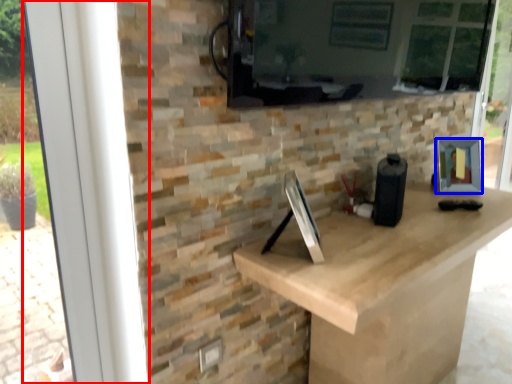
Question: Which point is closer to the camera, window frame (highlighted by a red box) or picture frame (highlighted by a blue box)?

Choices:
 (A) window frame
 (B) picture frame

Answer: (A)